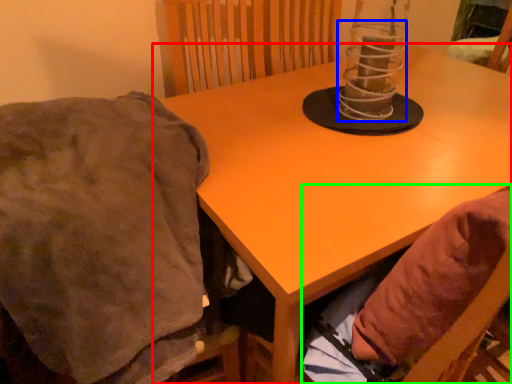
Question: Which object is positioned farthest from table (highlighted by a red box)? Select from candle holder (highlighted by a blue box) and bean bag chair (highlighted by a green box).

Choices:
 (A) candle holder
 (B) bean bag chair

Answer: (A)